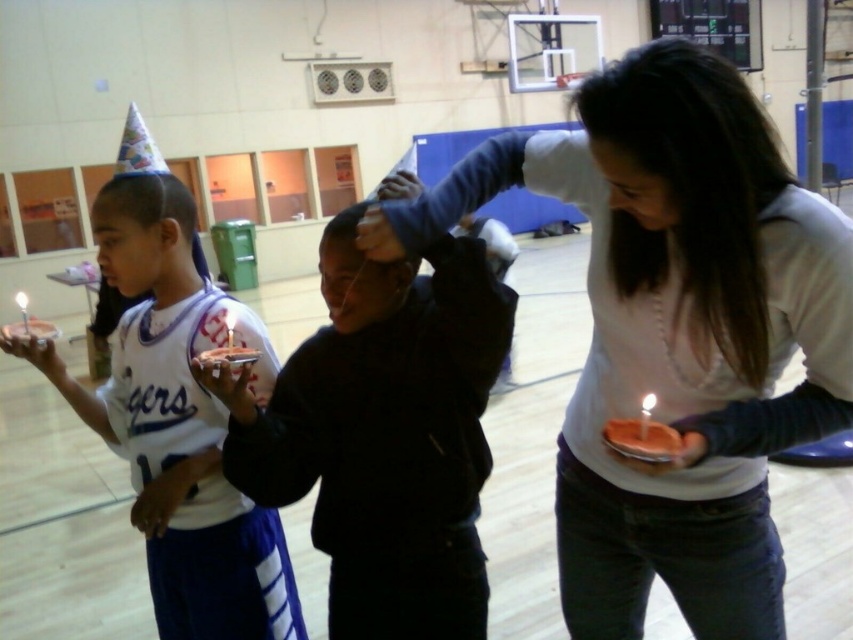
From the picture: You are organizing a candlelight event and need to determine which clothing item will be less likely to catch fire. Based on the scene, which item is smaller in size between the matte white shirt at center and the black matte jacket at center?

The black matte jacket at center is smaller in size than the matte white shirt at center, so it would be less likely to catch fire due to its smaller size.